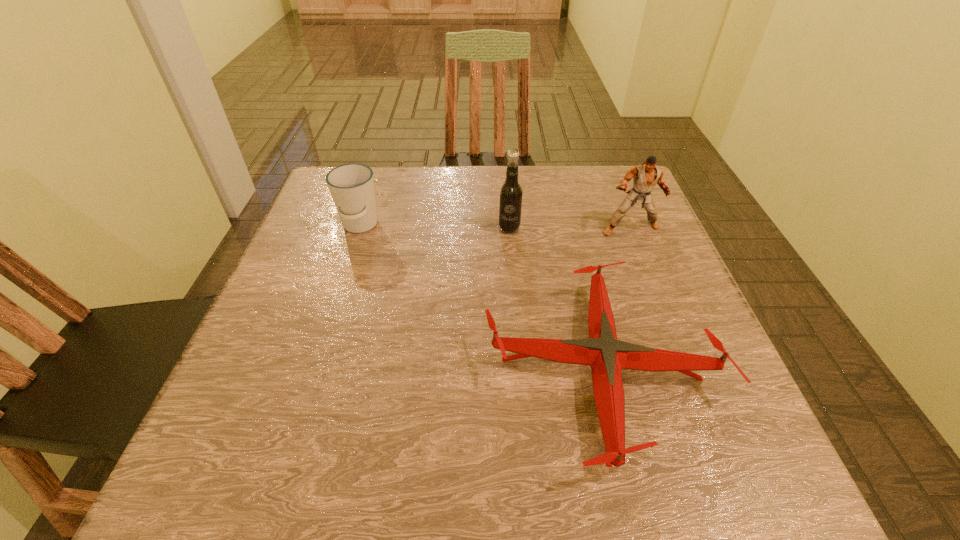
Locate an element on the screen. The image size is (960, 540). root beer is located at coordinates (510, 203).

The height and width of the screenshot is (540, 960). Identify the location of puncher. (645, 176).

The height and width of the screenshot is (540, 960). What are the coordinates of `the leftmost object` in the screenshot? It's located at [351, 186].

The height and width of the screenshot is (540, 960). I want to click on the third tallest object, so click(x=351, y=186).

You are a GUI agent. You are given a task and a screenshot of the screen. Output one action in this format:
    pyautogui.click(x=<x>, y=<y>)
    Task: Click on the nearest object
    Image resolution: width=960 pixels, height=540 pixels.
    Given the screenshot: What is the action you would take?
    pyautogui.click(x=607, y=356)

At what (x,y) coordinates should I click in order to perform the action: click on drone. Please return your answer as a coordinate pair (x, y). The width and height of the screenshot is (960, 540). Looking at the image, I should click on (607, 356).

Locate an element on the screen. The width and height of the screenshot is (960, 540). vacant space situated 0.100m on the label of the root beer is located at coordinates (512, 265).

I want to click on free spot located on the front-facing side of the puncher, so click(x=652, y=282).

Where is `free space located 0.190m with a handle on the side of the second shortest object`? This screenshot has width=960, height=540. free space located 0.190m with a handle on the side of the second shortest object is located at coordinates (335, 305).

Where is `vacant space located on the left of the nearest object`? vacant space located on the left of the nearest object is located at coordinates (402, 369).